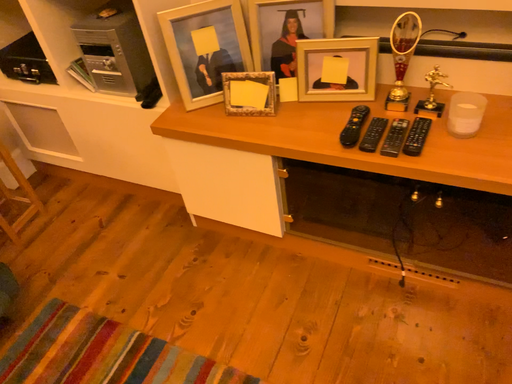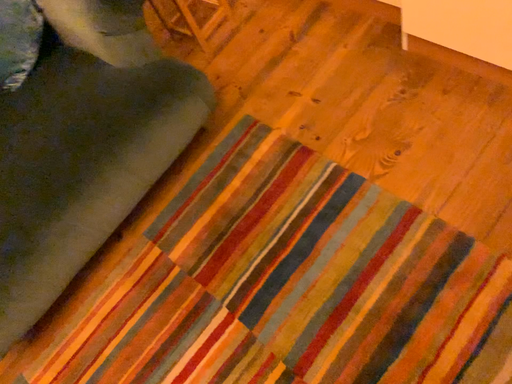
Question: Which way did the camera rotate in the video?

Choices:
 (A) rotated downward
 (B) rotated upward

Answer: (A)